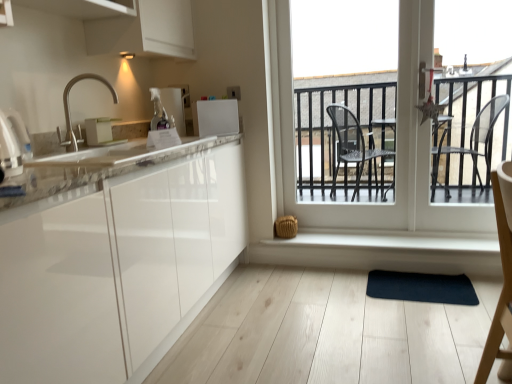
Question: From the image's perspective, is satin nickel faucet at upper left located above or below dark blue rubber yoga mat at center?

Choices:
 (A) below
 (B) above

Answer: (B)

Question: Would you say satin nickel faucet at upper left is to the left or to the right of dark blue rubber yoga mat at center in the picture?

Choices:
 (A) right
 (B) left

Answer: (B)

Question: Which of these objects is positioned farthest from the white glossy microwave at upper center, the 2th appliance positioned from the back?

Choices:
 (A) dark blue rubber yoga mat at center
 (B) white glossy electric kettle at left, acting as the first appliance starting from the front
 (C) transparent glass door at center
 (D) white matte window sill at lower center
 (E) satin nickel faucet at upper left

Answer: (A)

Question: Based on their relative distances, which object is farther from the metallic silver toaster at upper center, the 1th appliance from the back?

Choices:
 (A) white matte window sill at lower center
 (B) matte white toaster at upper left, which is the second appliance from front to back
 (C) satin nickel faucet at upper left
 (D) transparent glass door at center
 (E) white glossy electric kettle at left, acting as the first appliance starting from the front

Answer: (A)